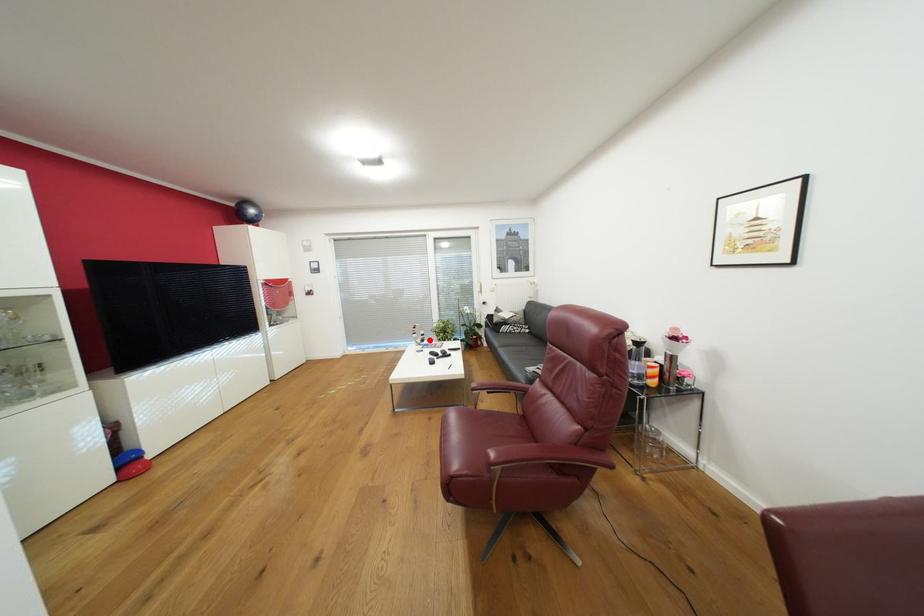
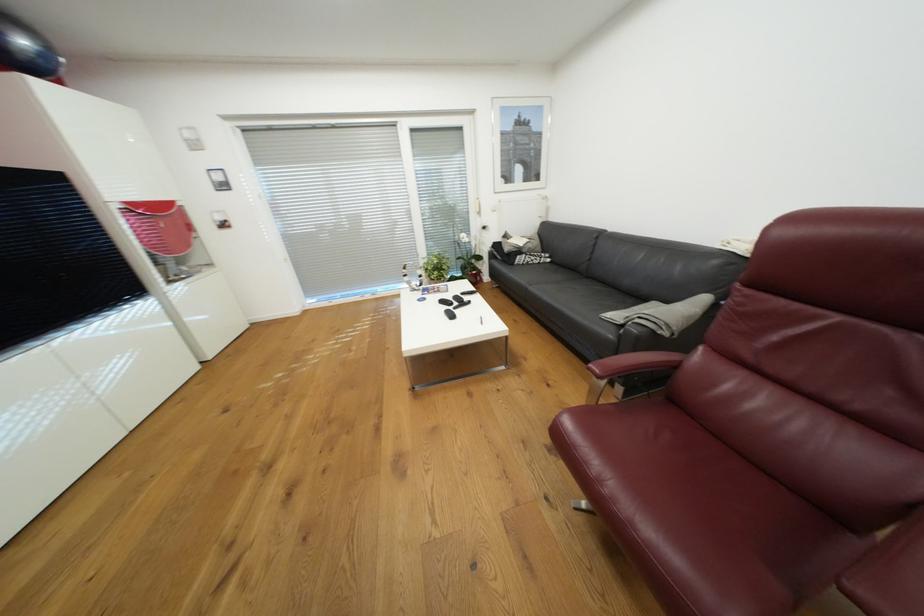
Question: I am providing you with two images of the same scene from different viewpoints. A red point is marked on the first image. At the location where the point appears in image 1, is it still visible in image 2?

Choices:
 (A) Yes
 (B) No

Answer: (A)